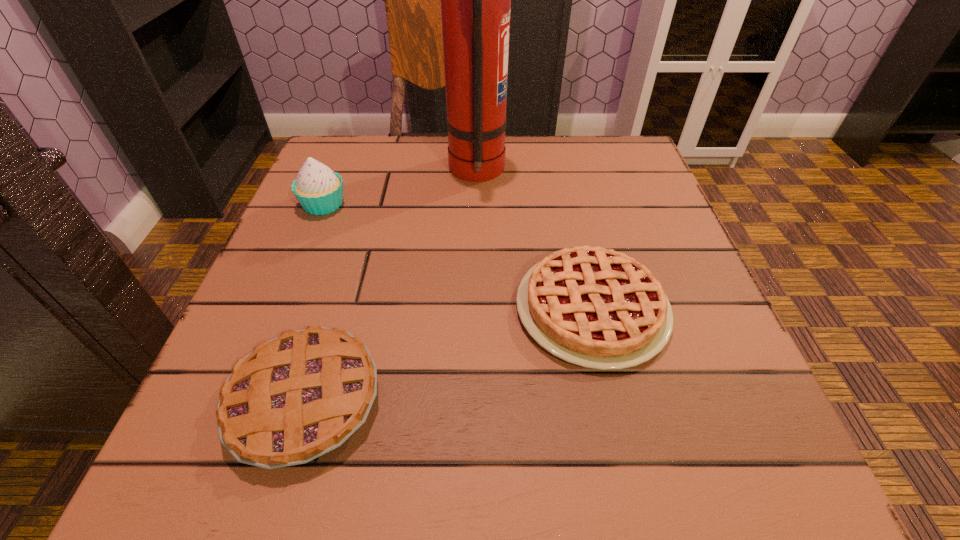
The height and width of the screenshot is (540, 960). What are the coordinates of `the tallest object` in the screenshot? It's located at (475, 0).

Identify the location of the second object from right to left. The width and height of the screenshot is (960, 540). (475, 0).

Find the location of a particular element. The width and height of the screenshot is (960, 540). cupcake is located at coordinates (319, 190).

Identify the location of the right pie. (594, 307).

You are a GUI agent. You are given a task and a screenshot of the screen. Output one action in this format:
    pyautogui.click(x=<x>, y=<y>)
    Task: Click on the left pie
    The image size is (960, 540).
    Given the screenshot: What is the action you would take?
    pyautogui.click(x=296, y=397)

Find the location of a particular element. The image size is (960, 540). free region located on the label side of the tallest object is located at coordinates (605, 171).

Where is `vacant space located on the front of the third shortest object`? vacant space located on the front of the third shortest object is located at coordinates (293, 279).

What are the coordinates of `vacant position located 0.270m on the back of the right pie` in the screenshot? It's located at (561, 173).

The width and height of the screenshot is (960, 540). Find the location of `free space located 0.220m on the right of the left pie`. free space located 0.220m on the right of the left pie is located at coordinates (545, 400).

Locate an element on the screen. The image size is (960, 540). fire extinguisher at the far edge is located at coordinates (475, 0).